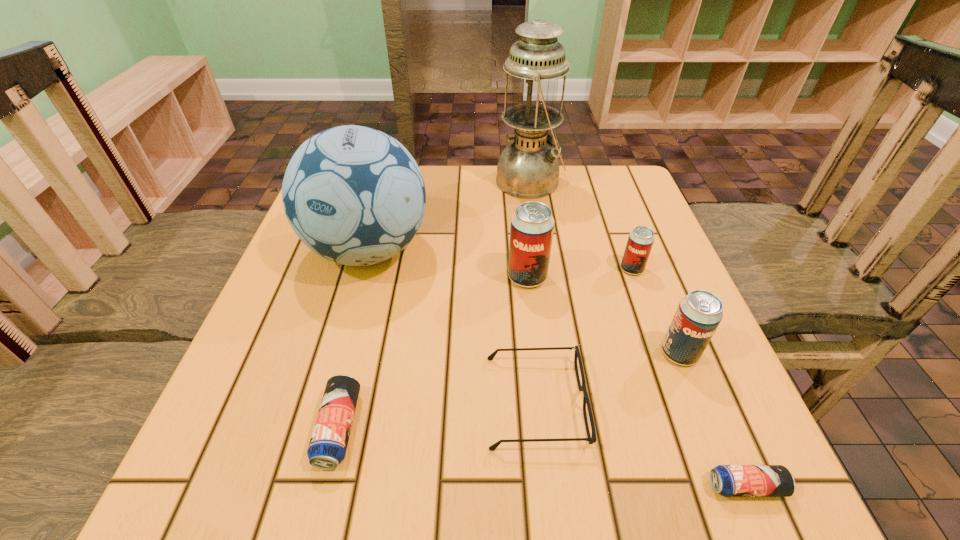
Where is `vacant space that satisfies the following two spatial constraints: 1. on the back side of the third tallest object; 2. on the right side of the oil lamp`? This screenshot has height=540, width=960. vacant space that satisfies the following two spatial constraints: 1. on the back side of the third tallest object; 2. on the right side of the oil lamp is located at coordinates (516, 181).

Image resolution: width=960 pixels, height=540 pixels. I want to click on free space that satisfies the following two spatial constraints: 1. on the front side of the farthest object; 2. on the front-facing side of the spectacles, so click(563, 402).

Where is `free spot that satisfies the following two spatial constraints: 1. on the back side of the biggest red beer can; 2. on the left side of the farthest object`? The height and width of the screenshot is (540, 960). free spot that satisfies the following two spatial constraints: 1. on the back side of the biggest red beer can; 2. on the left side of the farthest object is located at coordinates (516, 181).

The height and width of the screenshot is (540, 960). I want to click on vacant area in the image that satisfies the following two spatial constraints: 1. on the front side of the nearest beer can; 2. on the right side of the smallest red beer can, so click(x=711, y=487).

The image size is (960, 540). I want to click on free space that satisfies the following two spatial constraints: 1. on the front side of the oil lamp; 2. on the front-facing side of the spectacles, so click(x=563, y=402).